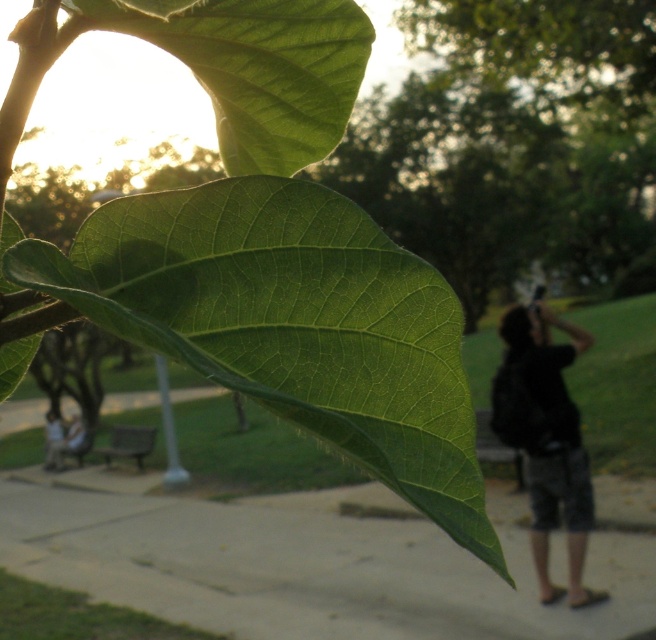
You are taking a photo of the green matte leaf at upper center in the park. The smooth concrete pavement at lower center is in the background. Since the leaf is your focus, will the pavement be more or less visible in your photo?

The smooth concrete pavement at lower center is larger in size than green matte leaf at upper center, so it will be less visible in the photo since the leaf is in focus and the pavement is out of focus and smaller in the frame.

You are a photographer trying to capture a clear shot of the green matte leaf at center and the dark gray cotton hoodie at right in the same frame. Given their distance apart, can you estimate whether you can fit both subjects into your camera viewfinder without moving your position?

The green matte leaf at center and dark gray cotton hoodie at right are 8.14 meters apart from each other. Depending on your camera lens, if it has a wide enough angle to cover an 8.14 meter span at your current distance, both subjects can be captured in the same frame.

You are a photographer trying to capture the green matte leaf at center and the dark gray cotton hoodie at right in the same frame. Based on their sizes in the image, which object would you need to move closer to in order to make them appear the same size?

The green matte leaf at center has a lesser width compared to the dark gray cotton hoodie at right. To make them appear the same size in the frame, you would need to move closer to the green matte leaf at center since it is smaller and requires a closer proximity to fill the frame similarly to the larger hoodie.